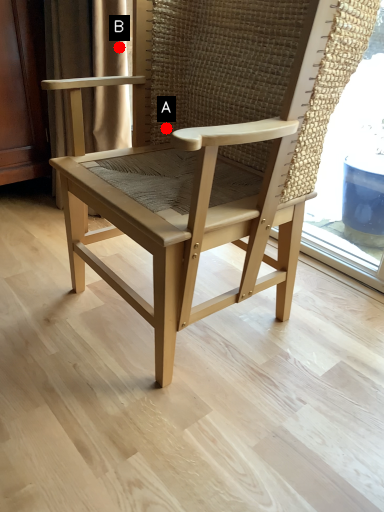
Question: Two points are circled on the image, labeled by A and B beside each circle. Which point is farther to the camera?

Choices:
 (A) A is further
 (B) B is further

Answer: (B)